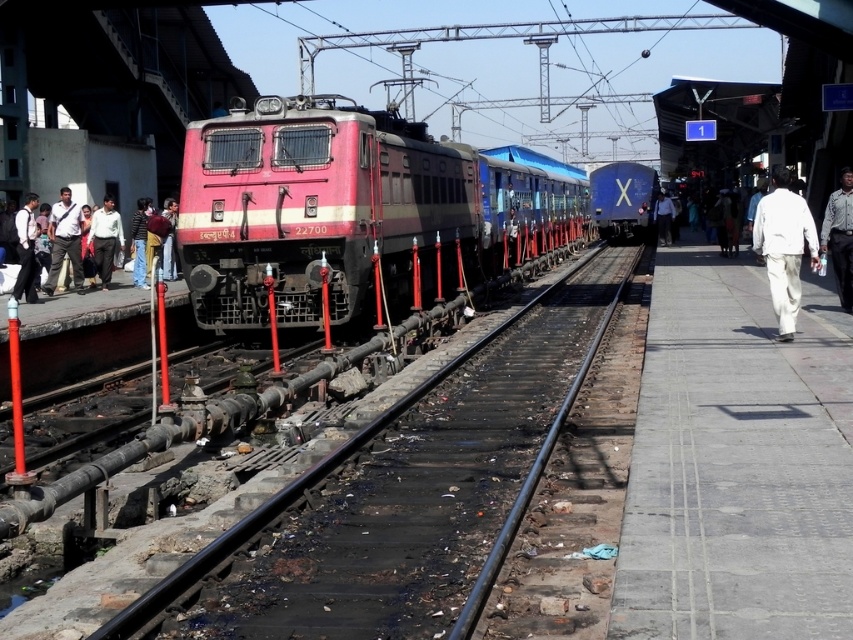
Is white cotton pants at right above matte black shirt at left?

Yes.

You are a GUI agent. You are given a task and a screenshot of the screen. Output one action in this format:
    pyautogui.click(x=<x>, y=<y>)
    Task: Click on the white cotton pants at right
    
    Given the screenshot: What is the action you would take?
    pyautogui.click(x=782, y=248)

At what (x,y) coordinates should I click in order to perform the action: click on white cotton pants at right. Please return your answer as a coordinate pair (x, y). This screenshot has width=853, height=640. Looking at the image, I should click on (782, 248).

Which is behind, point (787, 176) or point (616, 195)?

The point (616, 195) is behind.

Can you confirm if white cotton pants at right is shorter than blue glossy train at center?

No, white cotton pants at right is not shorter than blue glossy train at center.

Locate an element on the screen. The width and height of the screenshot is (853, 640). white cotton pants at right is located at coordinates (782, 248).

In the scene shown: Which is above, white cotton pants at right or white textured shirt at right?

white cotton pants at right is above.

Is point (811, 236) more distant than point (844, 220)?

That is False.

Who is more forward, (775,208) or (845,236)?

Point (775,208) is more forward.

Locate an element on the screen. The width and height of the screenshot is (853, 640). white cotton pants at right is located at coordinates (782, 248).